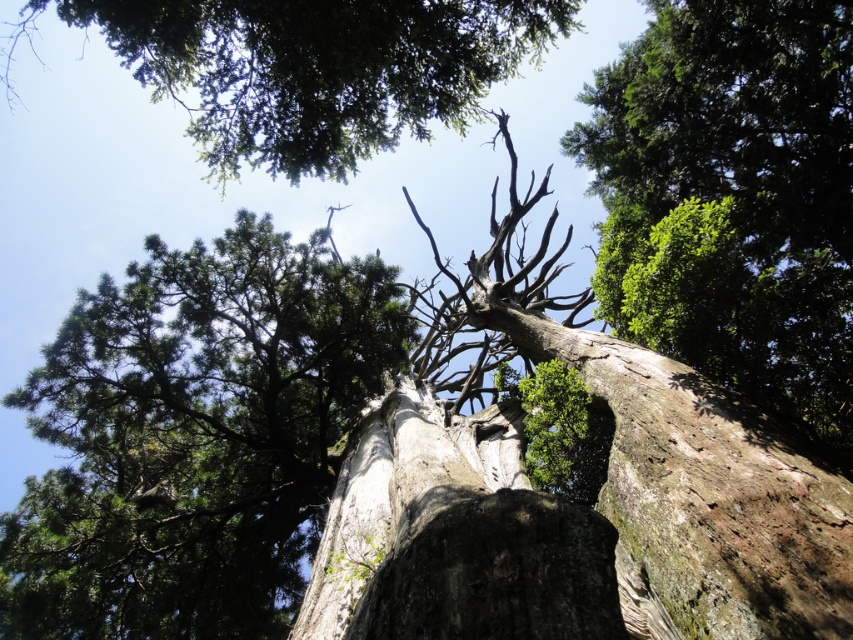
You are standing under the large tree and looking up. There is a point marked at coordinates (195, 436). What does this point represent?

The point at coordinates (195, 436) represents the green rough bark tree at center.

You are standing directly below the green rough bark tree at upper center. If you look up, where would you see the top of the tree relative to your field of view?

The top of the green rough bark tree at upper center would be located at the coordinates 0.108 on the x and 0.370 on the y axis in your field of view.